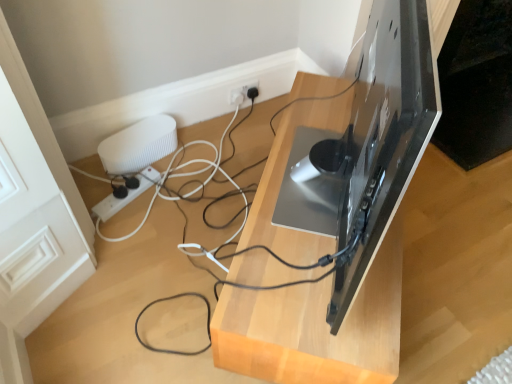
Question: Is point (105, 168) closer or farther from the camera than point (285, 294)?

Choices:
 (A) farther
 (B) closer

Answer: (A)

Question: Would you say white ribbed speaker at left is inside or outside matte black tv stand at center?

Choices:
 (A) inside
 (B) outside

Answer: (B)

Question: Which object is positioned farthest from the white plastic power strip at lower left?

Choices:
 (A) matte black tv stand at center
 (B) white ribbed speaker at left

Answer: (A)

Question: Which is farther from the matte black tv stand at center?

Choices:
 (A) white ribbed speaker at left
 (B) white plastic power strip at lower left

Answer: (B)